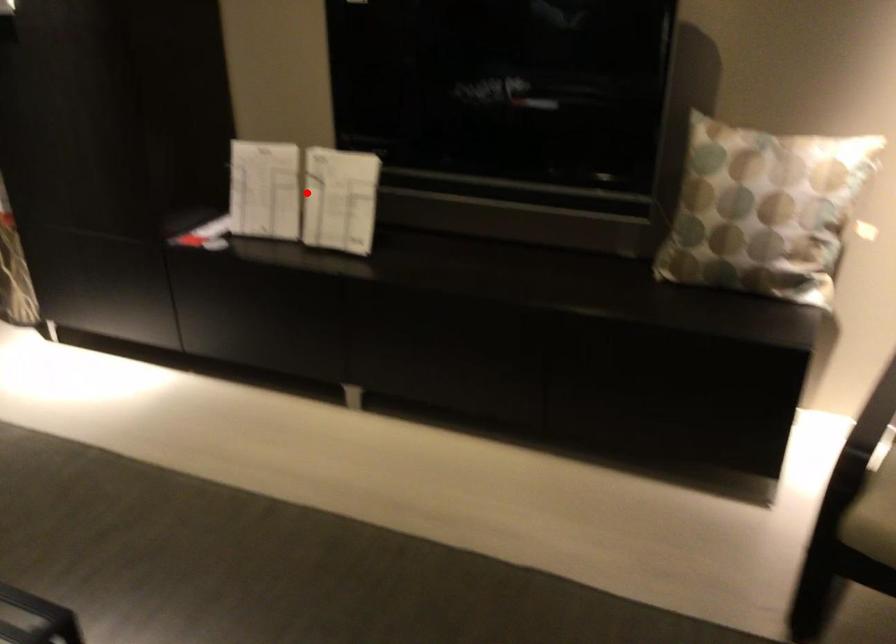
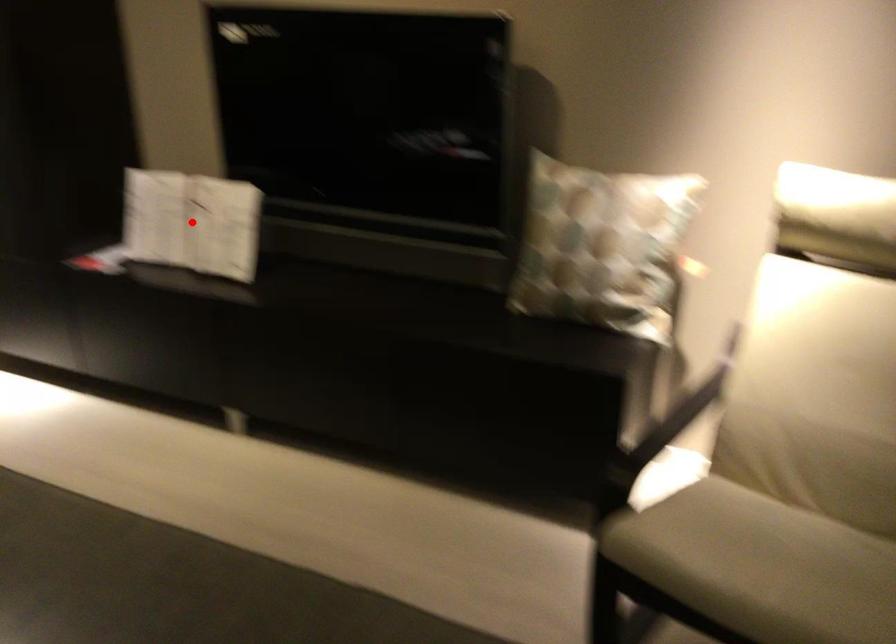
I am providing you with two images of the same scene from different viewpoints. A red point is marked on the first image and another point is marked on the second image. Is the marked point in image1 the same physical position as the marked point in image2?

Yes